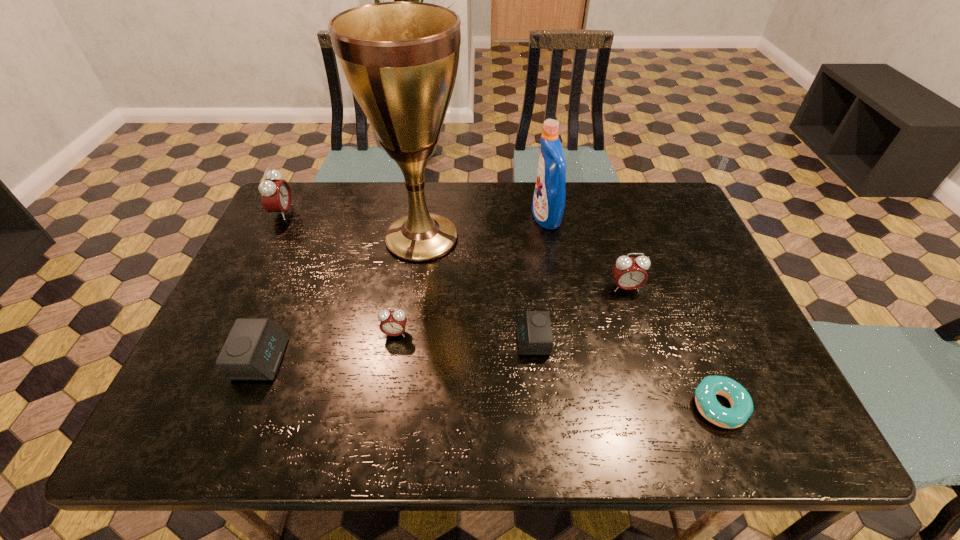
Locate which object ranks in proximity to the smallest pink alarm clock. Please provide its 2D coordinates. Your answer should be formatted as a tuple, i.e. [(x, y)], where the tuple contains the x and y coordinates of a point satisfying the conditions above.

[(400, 59)]

You are a GUI agent. You are given a task and a screenshot of the screen. Output one action in this format:
    pyautogui.click(x=<x>, y=<y>)
    Task: Click on the alarm clock that stands as the second closest to the trophy cup
    Image resolution: width=960 pixels, height=540 pixels.
    Given the screenshot: What is the action you would take?
    pyautogui.click(x=534, y=334)

Locate an element on the screen. The height and width of the screenshot is (540, 960). the second closest alarm clock to the shortest alarm clock is located at coordinates (393, 323).

Locate which pink alarm clock is the second closest to the second tallest alarm clock. Please provide its 2D coordinates. Your answer should be formatted as a tuple, i.e. [(x, y)], where the tuple contains the x and y coordinates of a point satisfying the conditions above.

[(276, 196)]

This screenshot has height=540, width=960. In order to click on pink alarm clock that stands as the closest to the smallest pink alarm clock in this screenshot , I will do (629, 273).

Find the location of `vacant space that satisfies the following two spatial constraints: 1. on the clock face of the second object from right to left; 2. on the front-facing side of the right black alarm clock`. vacant space that satisfies the following two spatial constraints: 1. on the clock face of the second object from right to left; 2. on the front-facing side of the right black alarm clock is located at coordinates (641, 341).

At what (x,y) coordinates should I click in order to perform the action: click on free space that satisfies the following two spatial constraints: 1. on the label of the detergent; 2. on the back side of the rightmost object. Please return your answer as a coordinate pair (x, y). The width and height of the screenshot is (960, 540). Looking at the image, I should click on click(578, 406).

You are a GUI agent. You are given a task and a screenshot of the screen. Output one action in this format:
    pyautogui.click(x=<x>, y=<y>)
    Task: Click on the vacant position in the image that satisfies the following two spatial constraints: 1. on the clock face of the second nearest pink alarm clock; 2. on the front-facing side of the bigger black alarm clock
    
    Given the screenshot: What is the action you would take?
    pyautogui.click(x=647, y=359)

At what (x,y) coordinates should I click in order to perform the action: click on vacant space that satisfies the following two spatial constraints: 1. on the label of the sixth object from left to right; 2. on the clock face of the nearest pink alarm clock. Please return your answer as a coordinate pair (x, y). The image size is (960, 540). Looking at the image, I should click on (565, 334).